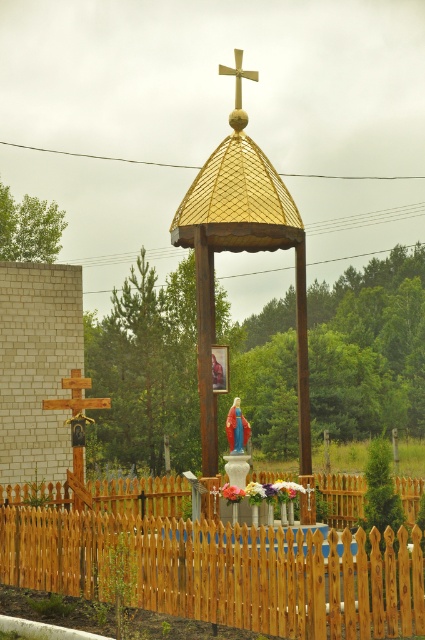
Question: Which is nearer to the wooden picket fence at center?

Choices:
 (A) gold metallic cross at upper center
 (B) matte blue statue at center

Answer: (B)

Question: Which of the following is the farthest from the observer?

Choices:
 (A) (56, 582)
 (B) (240, 403)
 (C) (238, 106)
 (D) (223, 189)

Answer: (B)

Question: Where is matte blue statue at center located in relation to gold metallic cross at upper center in the image?

Choices:
 (A) right
 (B) left

Answer: (B)

Question: Can you confirm if gold textured dome at center is wider than matte blue statue at center?

Choices:
 (A) yes
 (B) no

Answer: (B)

Question: Observing the image, what is the correct spatial positioning of matte blue statue at center in reference to gold metallic cross at upper center?

Choices:
 (A) above
 (B) below

Answer: (B)

Question: Which of the following is the farthest from the observer?

Choices:
 (A) (235, 51)
 (B) (396, 611)

Answer: (A)